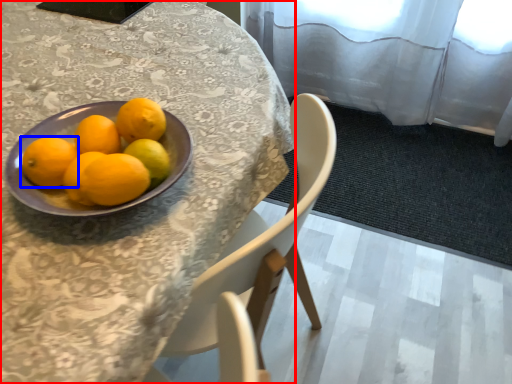
Question: Which object appears farthest to the camera in this image, table (highlighted by a red box) or orange (highlighted by a blue box)?

Choices:
 (A) table
 (B) orange

Answer: (B)